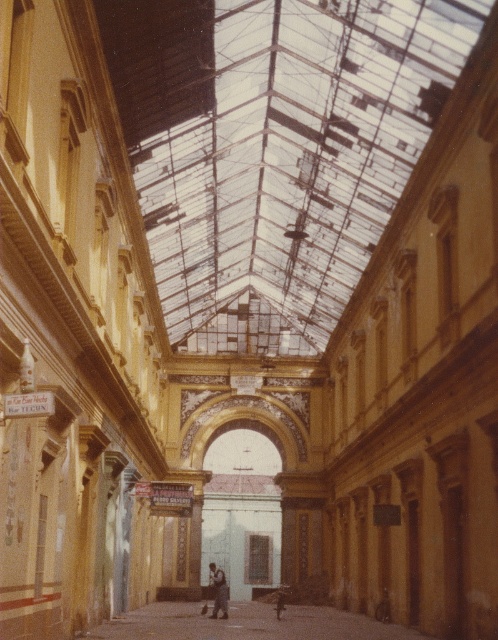
You are standing in the grand arcade and notice two items at the center of the image. Which item is closer to you, the smooth concrete alley at center or the dark blue jeans at center?

The smooth concrete alley at center is closer to you because it is positioned in front of the dark blue jeans at center.

You are standing in the grand arcade and notice the smooth concrete alley at center and the dark blue jeans at center. From your perspective, which object is located to the right of the other?

The smooth concrete alley at center is positioned on the right side of dark blue jeans at center, so the smooth concrete alley at center is to the right of the dark blue jeans at center.